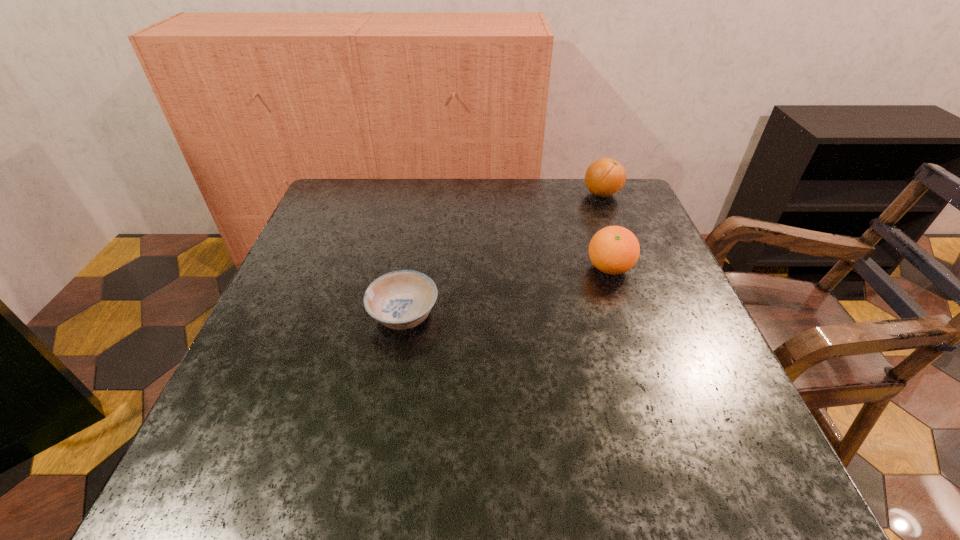
Locate an element on the screen. This screenshot has height=540, width=960. vacant point located between the farther orange and the shortest object is located at coordinates (503, 255).

This screenshot has width=960, height=540. I want to click on vacant area that lies between the shortest object and the farthest object, so click(x=503, y=255).

Find the location of a particular element. vacant point located between the leftmost object and the farthest object is located at coordinates (503, 255).

Select which object appears as the closest to the farthest object. Please provide its 2D coordinates. Your answer should be formatted as a tuple, i.e. [(x, y)], where the tuple contains the x and y coordinates of a point satisfying the conditions above.

[(613, 250)]

At what (x,y) coordinates should I click in order to perform the action: click on object that stands as the second closest to the nearest object. Please return your answer as a coordinate pair (x, y). This screenshot has width=960, height=540. Looking at the image, I should click on (605, 177).

Image resolution: width=960 pixels, height=540 pixels. Identify the location of vacant region that satisfies the following two spatial constraints: 1. on the back side of the second farthest object; 2. on the right side of the leftmost object. (412, 268).

Where is `vacant point that satisfies the following two spatial constraints: 1. on the back side of the farther orange; 2. on the right side of the bowl`? Image resolution: width=960 pixels, height=540 pixels. vacant point that satisfies the following two spatial constraints: 1. on the back side of the farther orange; 2. on the right side of the bowl is located at coordinates (425, 194).

Where is `vacant area that satisfies the following two spatial constraints: 1. on the back side of the shortest object; 2. on the right side of the farther orange`? The height and width of the screenshot is (540, 960). vacant area that satisfies the following two spatial constraints: 1. on the back side of the shortest object; 2. on the right side of the farther orange is located at coordinates (425, 194).

This screenshot has width=960, height=540. I want to click on blank area in the image that satisfies the following two spatial constraints: 1. on the back side of the nearer orange; 2. on the left side of the farther orange, so click(585, 194).